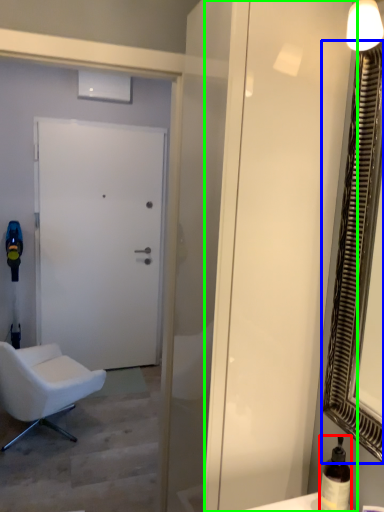
Question: Based on their relative distances, which object is nearer to bottle (highlighted by a red box)? Choose from mirror (highlighted by a blue box) and screen door (highlighted by a green box).

Choices:
 (A) mirror
 (B) screen door

Answer: (A)